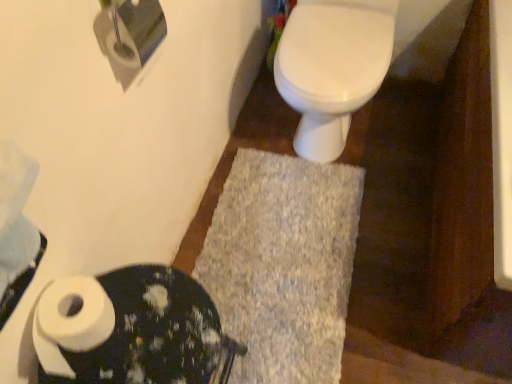
Question: Can you see white matte toilet paper at upper left, which is counted as the 2th toilet paper, starting from the bottom, touching white matte toilet paper at lower left?

Choices:
 (A) no
 (B) yes

Answer: (A)

Question: Is white matte toilet paper at upper left, which is counted as the 2th toilet paper, starting from the bottom, closer to the viewer compared to white matte toilet paper at lower left?

Choices:
 (A) no
 (B) yes

Answer: (B)

Question: From the image's perspective, is white matte toilet paper at upper left, which is counted as the 2th toilet paper, starting from the bottom, below white matte toilet paper at lower left?

Choices:
 (A) no
 (B) yes

Answer: (A)

Question: Can you confirm if white matte toilet paper at upper left, the 1th toilet paper positioned from the top, is smaller than white matte toilet paper at lower left?

Choices:
 (A) no
 (B) yes

Answer: (B)

Question: Is gray shaggy bath mat at center taller or shorter than white matte toilet paper at lower left?

Choices:
 (A) short
 (B) tall

Answer: (A)

Question: In terms of size, does gray shaggy bath mat at center appear bigger or smaller than white matte toilet paper at lower left?

Choices:
 (A) small
 (B) big

Answer: (A)

Question: From a real-world perspective, is gray shaggy bath mat at center physically located above or below white matte toilet paper at lower left?

Choices:
 (A) below
 (B) above

Answer: (A)

Question: Considering the positions of point (225, 231) and point (172, 271), is point (225, 231) closer or farther from the camera than point (172, 271)?

Choices:
 (A) closer
 (B) farther

Answer: (B)

Question: Considering their positions, is white matte toilet paper at upper left, which is counted as the 2th toilet paper, starting from the bottom, located in front of or behind white matte toilet paper at lower left, acting as the 1th toilet paper starting from the bottom?

Choices:
 (A) front
 (B) behind

Answer: (A)

Question: From a real-world perspective, is white matte toilet paper at upper left, the 1th toilet paper positioned from the top, physically located above or below white matte toilet paper at lower left, which is the 2th toilet paper from top to bottom?

Choices:
 (A) below
 (B) above

Answer: (B)

Question: Would you say white matte toilet paper at upper left, which is counted as the 2th toilet paper, starting from the bottom, is to the left or to the right of white matte toilet paper at lower left, which is the 2th toilet paper from top to bottom, in the picture?

Choices:
 (A) left
 (B) right

Answer: (B)

Question: In terms of size, does white matte toilet paper at upper left, which is counted as the 2th toilet paper, starting from the bottom, appear bigger or smaller than white matte toilet paper at lower left, acting as the 1th toilet paper starting from the bottom?

Choices:
 (A) big
 (B) small

Answer: (A)

Question: From the image's perspective, is white glossy toilet at center positioned above or below gray shaggy bath mat at center?

Choices:
 (A) below
 (B) above

Answer: (B)

Question: Is white glossy toilet at center spatially inside gray shaggy bath mat at center, or outside of it?

Choices:
 (A) outside
 (B) inside

Answer: (A)